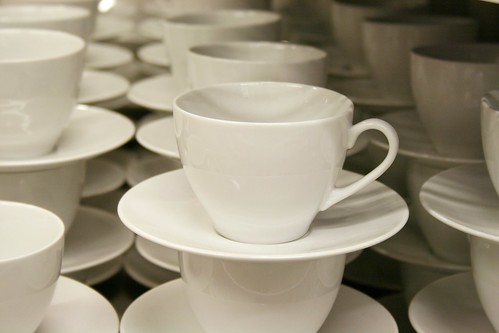
The height and width of the screenshot is (333, 499). What are the coordinates of `cups on top of stack` in the screenshot? It's located at (27, 278), (40, 91), (81, 31), (191, 35), (216, 66), (254, 160), (496, 145), (461, 99), (388, 52), (357, 30).